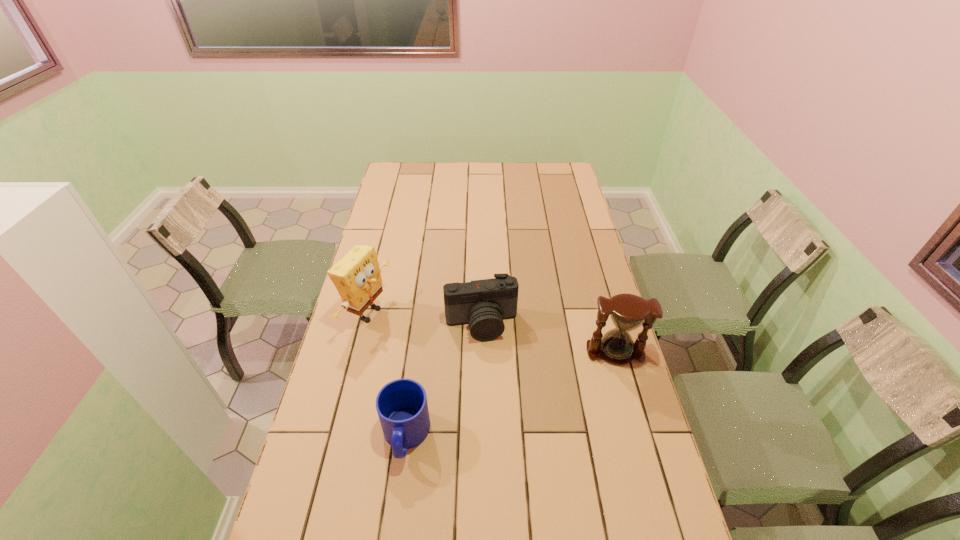
Choose which object is the nearest neighbor to the second object from right to left. Please provide its 2D coordinates. Your answer should be formatted as a tuple, i.e. [(x, y)], where the tuple contains the x and y coordinates of a point satisfying the conditions above.

[(357, 277)]